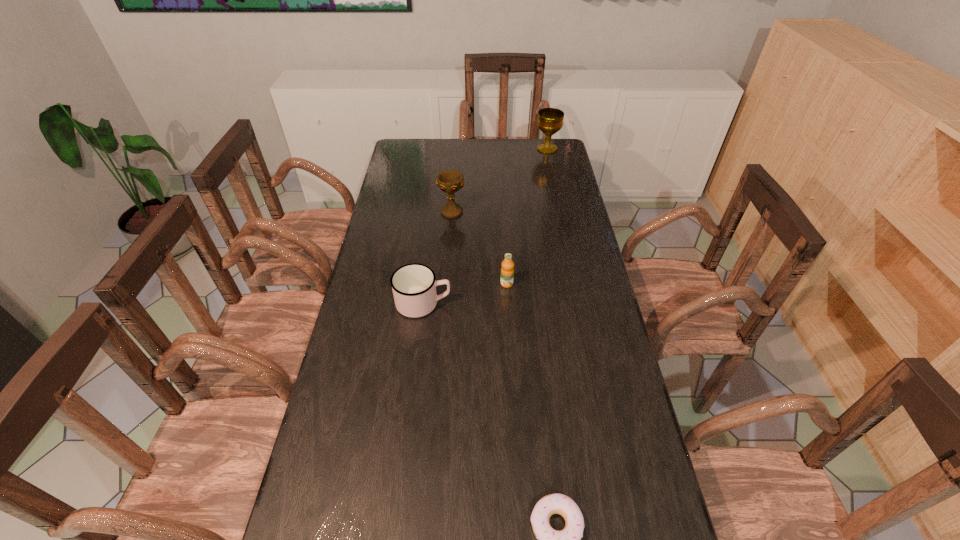
The height and width of the screenshot is (540, 960). I want to click on the rightmost object, so click(x=550, y=120).

I want to click on the farthest object, so click(x=550, y=120).

Where is `the nearer chalice`? Image resolution: width=960 pixels, height=540 pixels. the nearer chalice is located at coordinates (449, 181).

The image size is (960, 540). Identify the location of the left chalice. (449, 181).

This screenshot has height=540, width=960. In order to click on orange juice in this screenshot , I will do `click(507, 271)`.

Locate an element on the screen. mug is located at coordinates (414, 286).

What are the coordinates of `vacant space located 0.120m on the left of the farthest object` in the screenshot? It's located at (509, 148).

You are a GUI agent. You are given a task and a screenshot of the screen. Output one action in this format:
    pyautogui.click(x=<x>, y=<y>)
    Task: Click on the free point located on the back of the second farthest object
    Image resolution: width=960 pixels, height=540 pixels.
    Given the screenshot: What is the action you would take?
    pyautogui.click(x=454, y=180)

Where is `vacant space located on the label of the orange juice`? The height and width of the screenshot is (540, 960). vacant space located on the label of the orange juice is located at coordinates (511, 350).

This screenshot has height=540, width=960. What are the coordinates of `vacant area located on the side of the mug with the handle` in the screenshot? It's located at (581, 303).